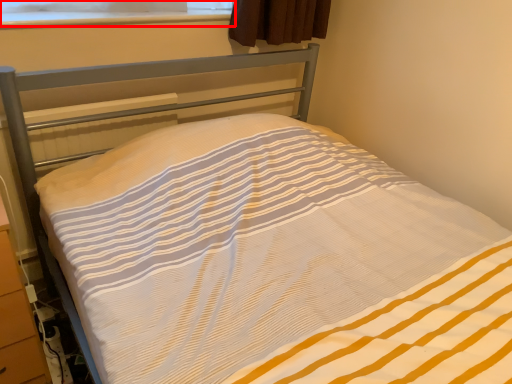
Question: Where is window screen (annotated by the red box) located in relation to dresser in the image?

Choices:
 (A) left
 (B) right

Answer: (B)